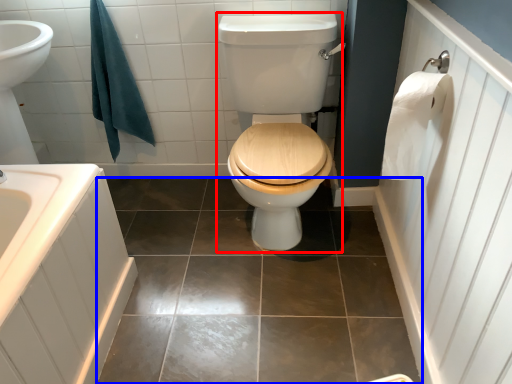
Question: Which object is closer to the camera taking this photo, sit (highlighted by a red box) or ceramic tile (highlighted by a blue box)?

Choices:
 (A) sit
 (B) ceramic tile

Answer: (A)